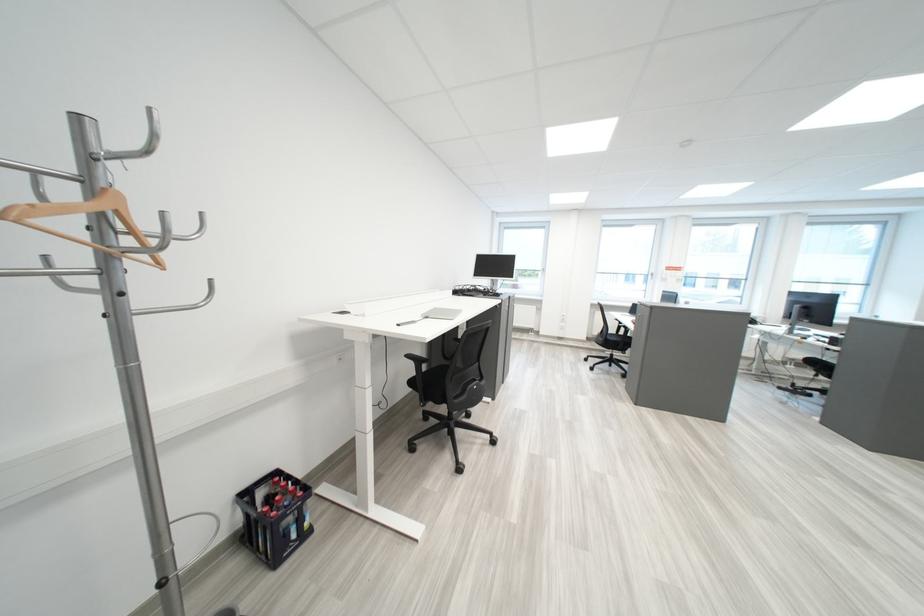
Find where to resting arm the black chair armrest. Please return your answer as a coordinate pair (x, y).

(419, 361)